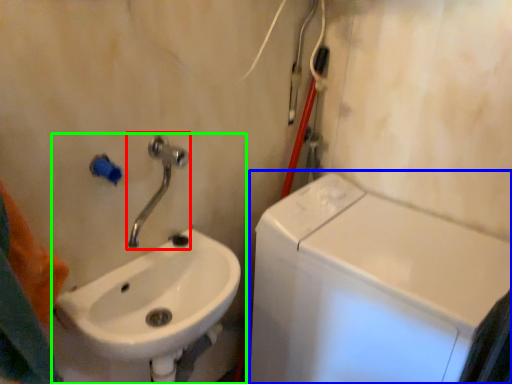
Question: Which object is positioned closest to tap (highlighted by a red box)? Select from washing machine (highlighted by a blue box) and sink (highlighted by a green box).

Choices:
 (A) washing machine
 (B) sink

Answer: (B)